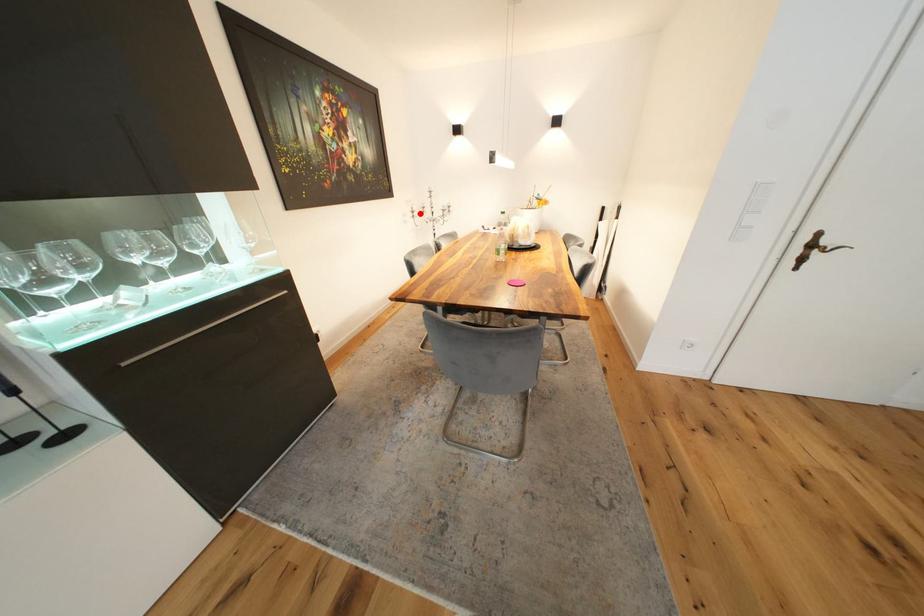
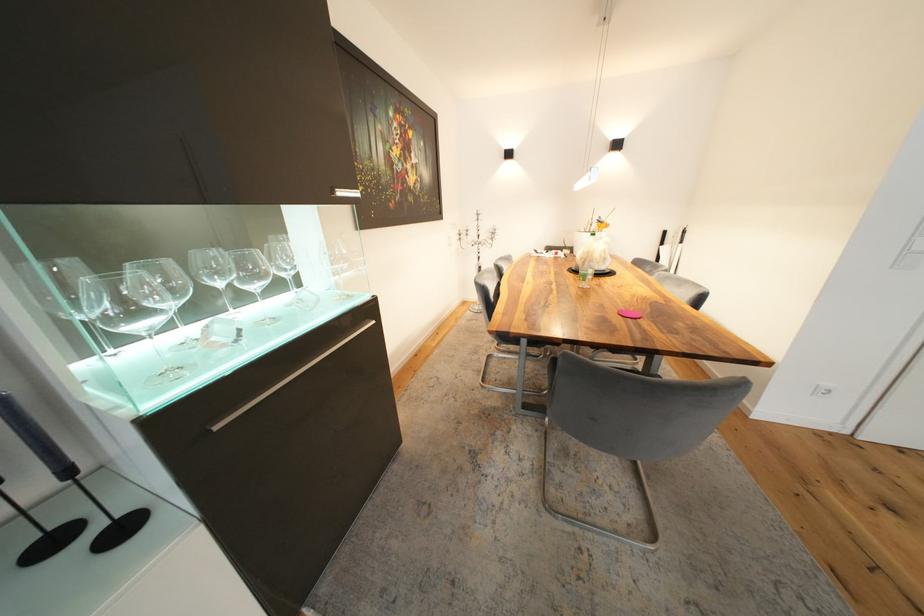
Find the pixel in the second image that matches the highlighted location in the first image.

(467, 236)